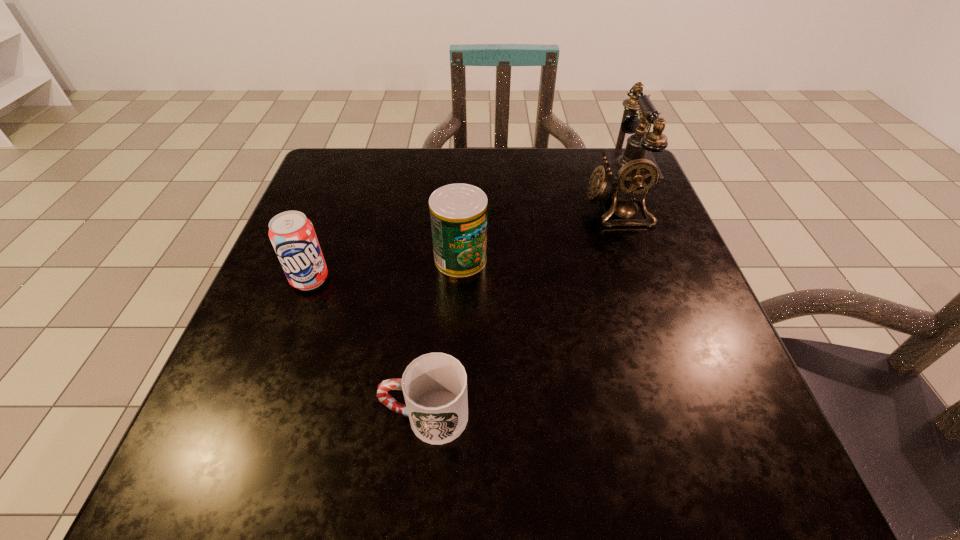
Where is `free space between the leftmost object and the shortest object`? The width and height of the screenshot is (960, 540). free space between the leftmost object and the shortest object is located at coordinates (368, 348).

Select which object is the third closest to the leftmost object. Please provide its 2D coordinates. Your answer should be formatted as a tuple, i.e. [(x, y)], where the tuple contains the x and y coordinates of a point satisfying the conditions above.

[(628, 176)]

Locate an element on the screen. This screenshot has width=960, height=540. object that is the closest to the cup is located at coordinates (458, 212).

Locate an element on the screen. Image resolution: width=960 pixels, height=540 pixels. free space in the image that satisfies the following two spatial constraints: 1. on the handle side of the cup; 2. on the back side of the can is located at coordinates (441, 259).

Where is `vacant position in the image that satisfies the following two spatial constraints: 1. on the rotary dial of the rightmost object; 2. on the front side of the soda can`? vacant position in the image that satisfies the following two spatial constraints: 1. on the rotary dial of the rightmost object; 2. on the front side of the soda can is located at coordinates (641, 279).

Find the location of a particular element. vacant space that satisfies the following two spatial constraints: 1. on the handle side of the shortest object; 2. on the front side of the leftmost object is located at coordinates (439, 279).